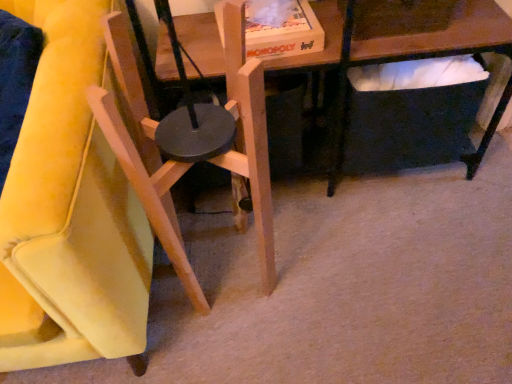
Question: Should I look upward or downward to see wooden chair at left, arranged as the first chair when viewed from the left?

Choices:
 (A) down
 (B) up

Answer: (B)

Question: Considering the relative sizes of natural wood chair at center, positioned as the first chair in right-to-left order, and wooden chair at left, arranged as the first chair when viewed from the left, in the image provided, is natural wood chair at center, positioned as the first chair in right-to-left order, thinner than wooden chair at left, arranged as the first chair when viewed from the left,?

Choices:
 (A) yes
 (B) no

Answer: (A)

Question: Is the position of natural wood chair at center, which is the second chair from left to right, more distant than that of wooden chair at left, which is counted as the second chair, starting from the right?

Choices:
 (A) yes
 (B) no

Answer: (A)

Question: Can you confirm if natural wood chair at center, which is the second chair from left to right, is shorter than wooden chair at left, which is counted as the second chair, starting from the right?

Choices:
 (A) no
 (B) yes

Answer: (B)

Question: Is natural wood chair at center, positioned as the first chair in right-to-left order, not close to wooden chair at left, which is counted as the second chair, starting from the right?

Choices:
 (A) no
 (B) yes

Answer: (A)

Question: Is natural wood chair at center, positioned as the first chair in right-to-left order, bigger than wooden chair at left, arranged as the first chair when viewed from the left?

Choices:
 (A) yes
 (B) no

Answer: (B)

Question: Is natural wood chair at center, positioned as the first chair in right-to-left order, closer to camera compared to wooden chair at left, which is counted as the second chair, starting from the right?

Choices:
 (A) no
 (B) yes

Answer: (A)

Question: Is wooden chair at left, which is counted as the second chair, starting from the right, positioned before natural wood chair at center, positioned as the first chair in right-to-left order?

Choices:
 (A) yes
 (B) no

Answer: (A)

Question: Is wooden chair at left, arranged as the first chair when viewed from the left, smaller than natural wood chair at center, positioned as the first chair in right-to-left order?

Choices:
 (A) no
 (B) yes

Answer: (A)

Question: Is wooden chair at left, which is counted as the second chair, starting from the right, at the right side of natural wood chair at center, which is the second chair from left to right?

Choices:
 (A) yes
 (B) no

Answer: (B)

Question: Can you confirm if wooden chair at left, which is counted as the second chair, starting from the right, is taller than natural wood chair at center, positioned as the first chair in right-to-left order?

Choices:
 (A) no
 (B) yes

Answer: (B)

Question: Is wooden chair at left, which is counted as the second chair, starting from the right, oriented away from natural wood chair at center, which is the second chair from left to right?

Choices:
 (A) no
 (B) yes

Answer: (A)

Question: From the image's perspective, does wooden chair at left, arranged as the first chair when viewed from the left, appear lower than natural wood chair at center, positioned as the first chair in right-to-left order?

Choices:
 (A) yes
 (B) no

Answer: (B)

Question: Choose the correct answer: Is natural wood chair at center, which is the second chair from left to right, inside wooden chair at left, which is counted as the second chair, starting from the right, or outside it?

Choices:
 (A) inside
 (B) outside

Answer: (B)